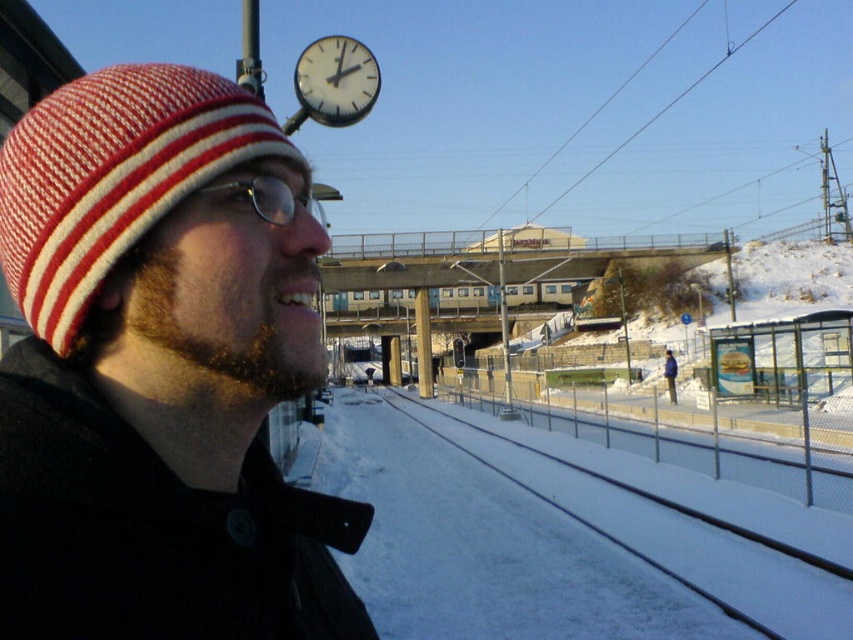
Looking at this image, does red and white striped knit cap at left have a larger size compared to snow-covered metal train track at lower center?

No, red and white striped knit cap at left is not bigger than snow-covered metal train track at lower center.

Does red and white striped knit cap at left appear on the right side of snow-covered metal train track at lower center?

No, red and white striped knit cap at left is not to the right of snow-covered metal train track at lower center.

Does point (38, 195) lie in front of point (637, 499)?

That is True.

The width and height of the screenshot is (853, 640). I want to click on red and white striped knit cap at left, so click(x=113, y=177).

Does knitted woolen hat at upper left have a lesser width compared to clear plastic glasses at upper center?

Indeed, knitted woolen hat at upper left has a lesser width compared to clear plastic glasses at upper center.

Is knitted woolen hat at upper left to the right of clear plastic glasses at upper center from the viewer's perspective?

Correct, you'll find knitted woolen hat at upper left to the right of clear plastic glasses at upper center.

Does point (183, 403) come closer to viewer compared to point (256, 177)?

That is True.

Where is `knitted woolen hat at upper left`? knitted woolen hat at upper left is located at coordinates point(160,372).

Between point (263, 381) and point (351, 83), which one is positioned in front?

Positioned in front is point (263, 381).

Can you confirm if knitted woolen hat at upper left is thinner than white glossy clock at upper center?

Yes, knitted woolen hat at upper left is thinner than white glossy clock at upper center.

Is point (9, 602) farther from camera compared to point (360, 104)?

No, (9, 602) is closer to viewer.

Identify the location of knitted woolen hat at upper left. (160, 372).